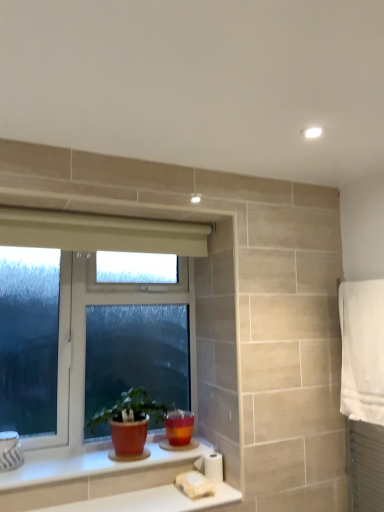
Question: Is white glossy counter top at lower center, acting as the 1th counter top starting from the bottom, to the left or to the right of white cotton towel at right in the image?

Choices:
 (A) left
 (B) right

Answer: (A)

Question: Considering the positions of point (56, 509) and point (355, 349), is point (56, 509) closer or farther from the camera than point (355, 349)?

Choices:
 (A) closer
 (B) farther

Answer: (A)

Question: Estimate the real-world distances between objects in this image. Which object is farther from the white plastic window at lower left?

Choices:
 (A) white glossy counter top at lower center, acting as the 1th counter top starting from the bottom
 (B) matte terracotta pot at lower center
 (C) white glossy counter top at lower center, which is the first counter top from top to bottom
 (D) white cotton towel at right
 (E) white matte toilet paper at lower center

Answer: (D)

Question: Estimate the real-world distances between objects in this image. Which object is closer to the white matte toilet paper at lower center?

Choices:
 (A) white glossy counter top at lower center, arranged as the second counter top when ordered from the bottom
 (B) matte terracotta pot at lower center
 (C) white cotton towel at right
 (D) white plastic window at lower left
 (E) white glossy counter top at lower center, acting as the 1th counter top starting from the bottom

Answer: (E)